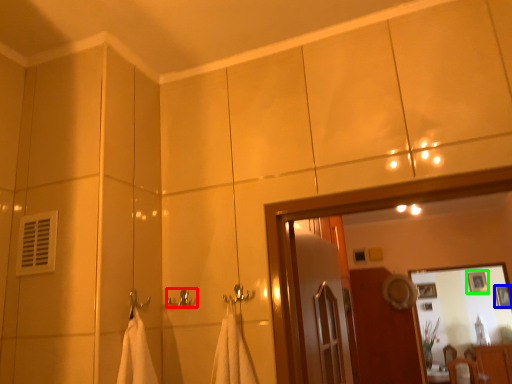
Question: Which is nearer to the towel bar (highlighted by a red box)? picture frame (highlighted by a blue box) or picture frame (highlighted by a green box).

Choices:
 (A) picture frame
 (B) picture frame

Answer: (B)